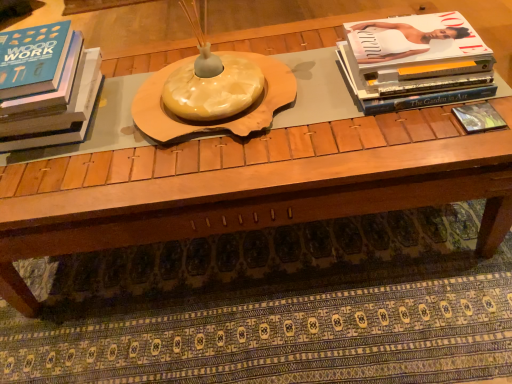
The height and width of the screenshot is (384, 512). I want to click on free point above matte white book at upper right, the 2th book when ordered from right to left (from a real-world perspective), so click(x=412, y=41).